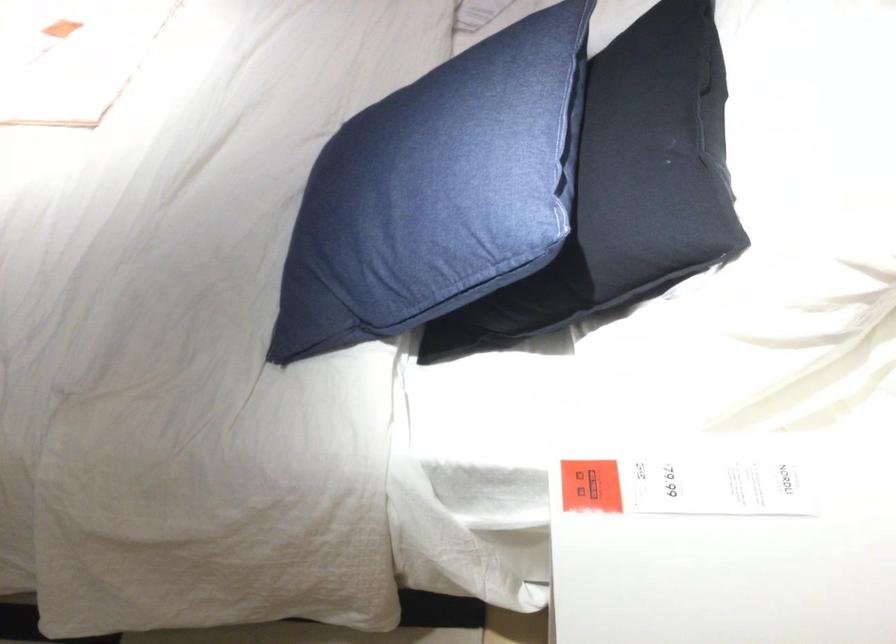
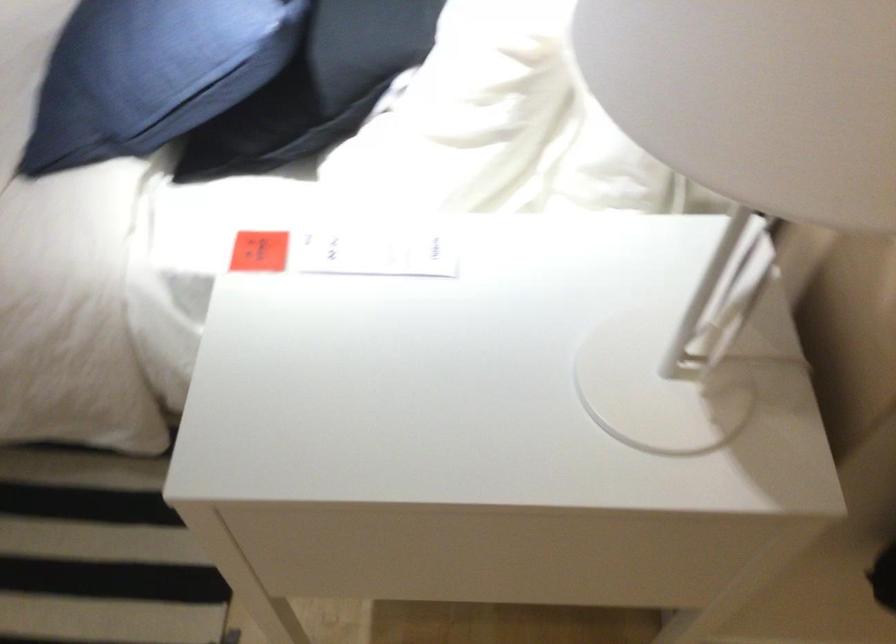
Where in the second image is the point corresponding to (716,480) from the first image?

(375, 252)